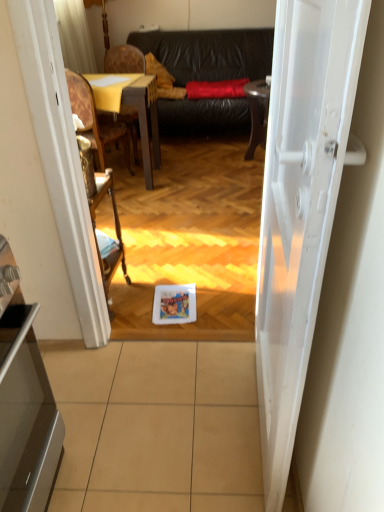
Question: In the image, is wooden armchair at center positioned in front of or behind wooden textured chair at left, the 2th chair when ordered from front to back?

Choices:
 (A) front
 (B) behind

Answer: (A)

Question: Considering the positions of wooden armchair at center and wooden textured chair at left, which is the first chair in back-to-front order, in the image, is wooden armchair at center taller or shorter than wooden textured chair at left, which is the first chair in back-to-front order,?

Choices:
 (A) tall
 (B) short

Answer: (B)

Question: Estimate the real-world distances between objects in this image. Which object is farther from the white glossy door at center?

Choices:
 (A) wooden textured chair at left, which is the first chair in back-to-front order
 (B) beige tile at center
 (C) wooden polished chair at left, arranged as the first chair when viewed from the front
 (D) black leather couch at center
 (E) metallic silver oven at lower left

Answer: (D)

Question: Which object is the closest to the wooden armchair at center?

Choices:
 (A) metallic silver oven at lower left
 (B) white glossy door at center
 (C) wooden polished chair at left, which is counted as the second chair, starting from the back
 (D) beige tile at center
 (E) wooden textured chair at left, which is the first chair in back-to-front order

Answer: (C)